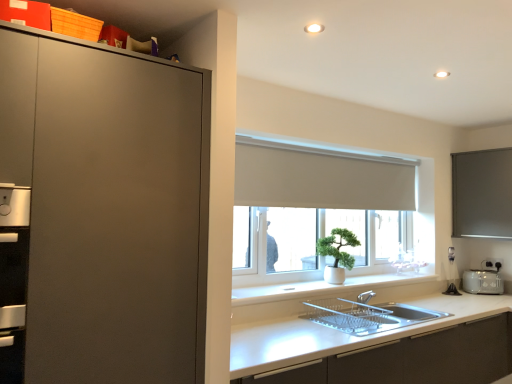
Question: Considering the positions of white matte cabinet at lower center and white plastic toaster at right in the image, is white matte cabinet at lower center wider or thinner than white plastic toaster at right?

Choices:
 (A) thin
 (B) wide

Answer: (B)

Question: Is point (510, 347) positioned closer to the camera than point (465, 291)?

Choices:
 (A) farther
 (B) closer

Answer: (B)

Question: Based on their relative distances, which object is farther from the matte gray window screen at right?

Choices:
 (A) white matte cabinet at lower center
 (B) white smooth window sill at center
 (C) white matte window at center
 (D) white plastic toaster at right

Answer: (A)

Question: Which is nearer to the white matte window at center?

Choices:
 (A) white smooth window sill at center
 (B) matte gray window screen at right
 (C) white matte cabinet at lower center
 (D) white plastic toaster at right

Answer: (A)